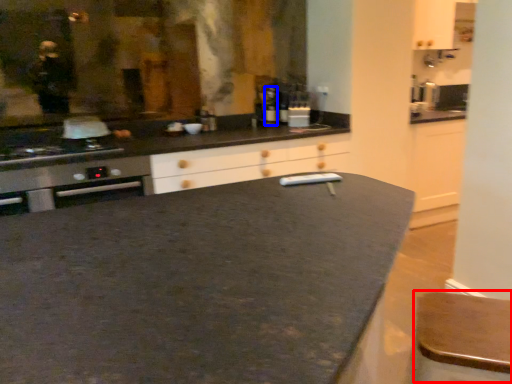
Question: Which object appears closest to the camera in this image, bar stool (highlighted by a red box) or bottle (highlighted by a blue box)?

Choices:
 (A) bar stool
 (B) bottle

Answer: (A)